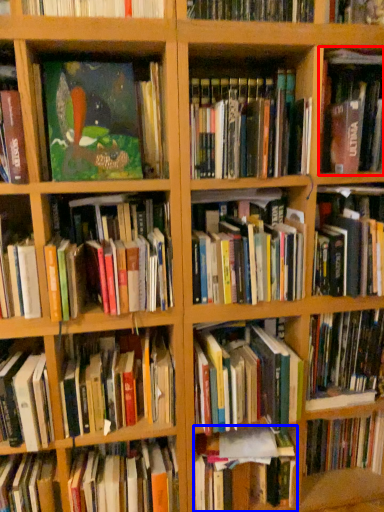
Question: Which point is further to the camera, book (highlighted by a red box) or book (highlighted by a blue box)?

Choices:
 (A) book
 (B) book

Answer: (B)